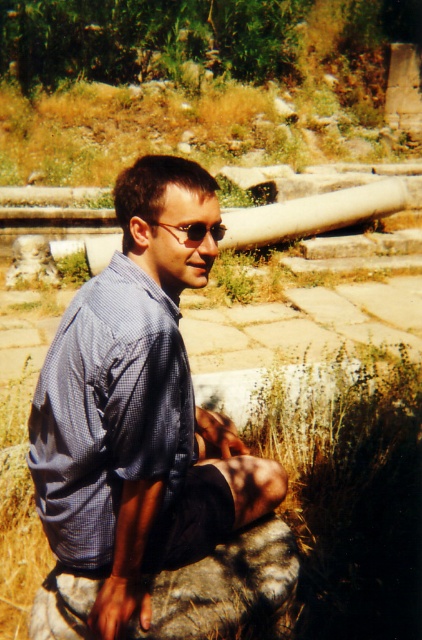
Question: Which point is farther from the camera taking this photo?

Choices:
 (A) (211, 228)
 (B) (267, 481)
 (C) (48, 364)

Answer: (B)

Question: Which point is closer to the camera?

Choices:
 (A) (248, 516)
 (B) (40, 483)

Answer: (B)

Question: Can you confirm if blue checkered shirt at center is positioned to the left of matte black sunglasses at center?

Choices:
 (A) yes
 (B) no

Answer: (A)

Question: Can you confirm if blue checkered dress shirt at center is positioned to the right of matte black sunglasses at center?

Choices:
 (A) yes
 (B) no

Answer: (B)

Question: Does blue checkered shirt at center have a smaller size compared to matte black sunglasses at center?

Choices:
 (A) no
 (B) yes

Answer: (A)

Question: Estimate the real-world distances between objects in this image. Which object is closer to the matte black sunglasses at center?

Choices:
 (A) blue checkered shirt at center
 (B) blue checkered dress shirt at center

Answer: (B)